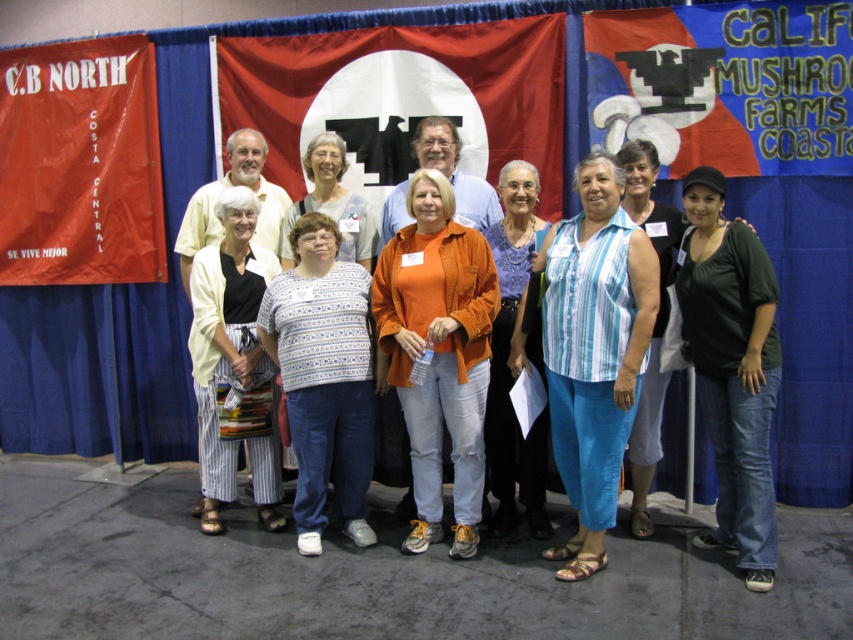
Question: Is dark green jersey at center to the right of striped cotton pants at center from the viewer's perspective?

Choices:
 (A) yes
 (B) no

Answer: (A)

Question: Among these objects, which one is farthest from the camera?

Choices:
 (A) orange matte shirt at center
 (B) striped cotton pants at center
 (C) blue striped tank top at center
 (D) matte purple blouse at center

Answer: (B)

Question: Which point is closer to the camera taking this photo?

Choices:
 (A) (659, 272)
 (B) (637, 164)
 (C) (482, 445)
 (D) (772, 289)

Answer: (A)

Question: Which point is farther from the camera taking this photo?

Choices:
 (A) (621, 461)
 (B) (405, 298)

Answer: (B)

Question: Can you confirm if blue striped tank top at center is wider than matte purple blouse at center?

Choices:
 (A) no
 (B) yes

Answer: (B)

Question: Can you confirm if matte purple blouse at center is thinner than matte black tank top at center?

Choices:
 (A) yes
 (B) no

Answer: (B)